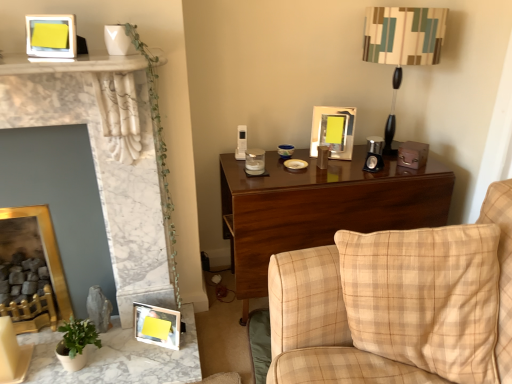
Find the location of a particular element. The height and width of the screenshot is (384, 512). vacant space in front of metallic silver picture frame at upper center, which is the 3th picture frame from bottom to top is located at coordinates (339, 161).